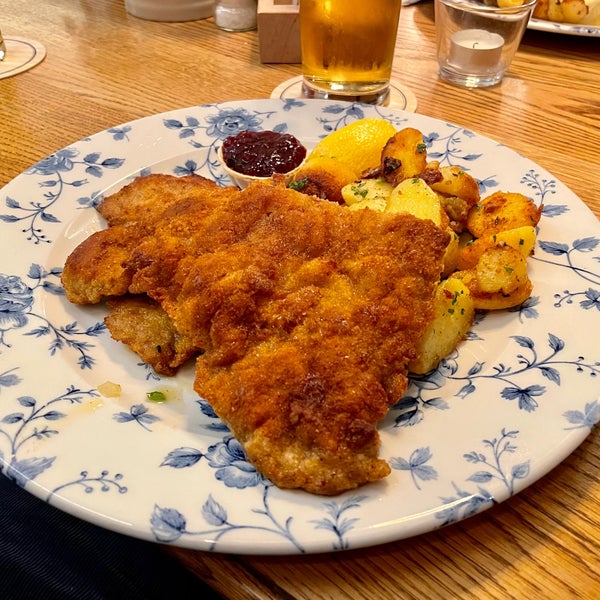
Find the location of a particular element. The width and height of the screenshot is (600, 600). wooden box is located at coordinates click(x=279, y=28).